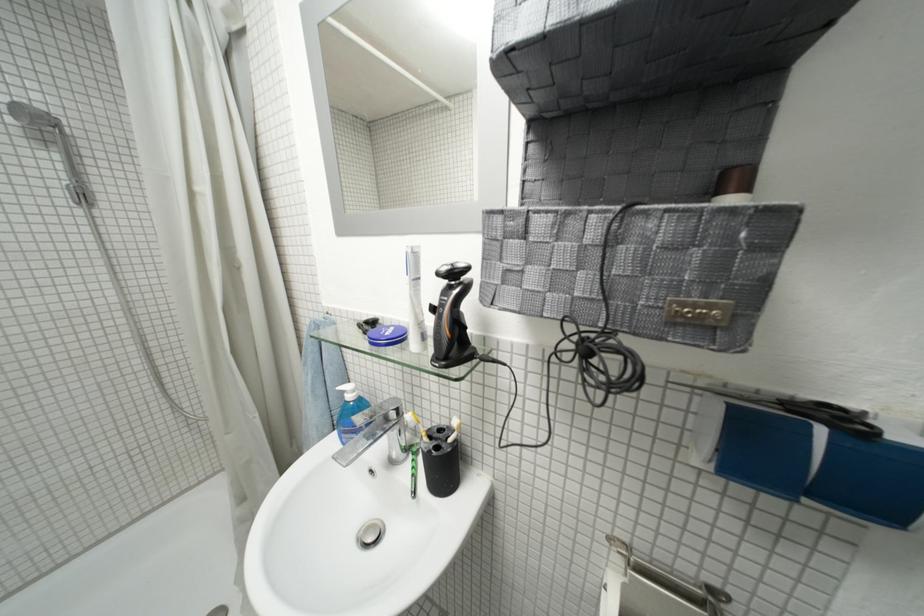
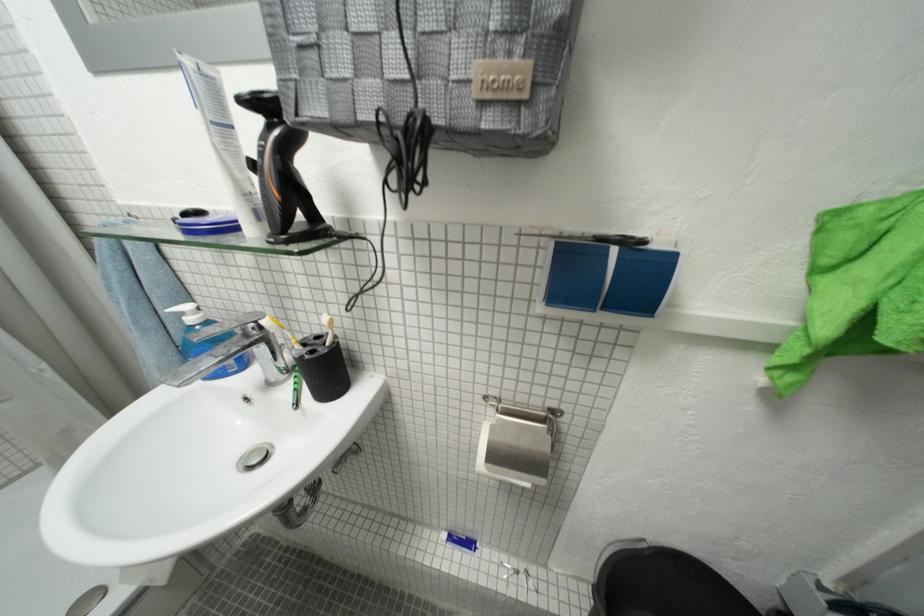
Locate, in the second image, the point that corresponds to (767,394) in the first image.

(592, 237)